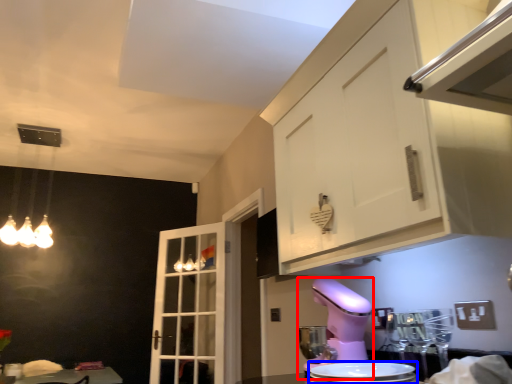
Question: Which of the following is the farthest to the observer, mixer (highlighted by a red box) or appliance (highlighted by a blue box)?

Choices:
 (A) mixer
 (B) appliance

Answer: (A)